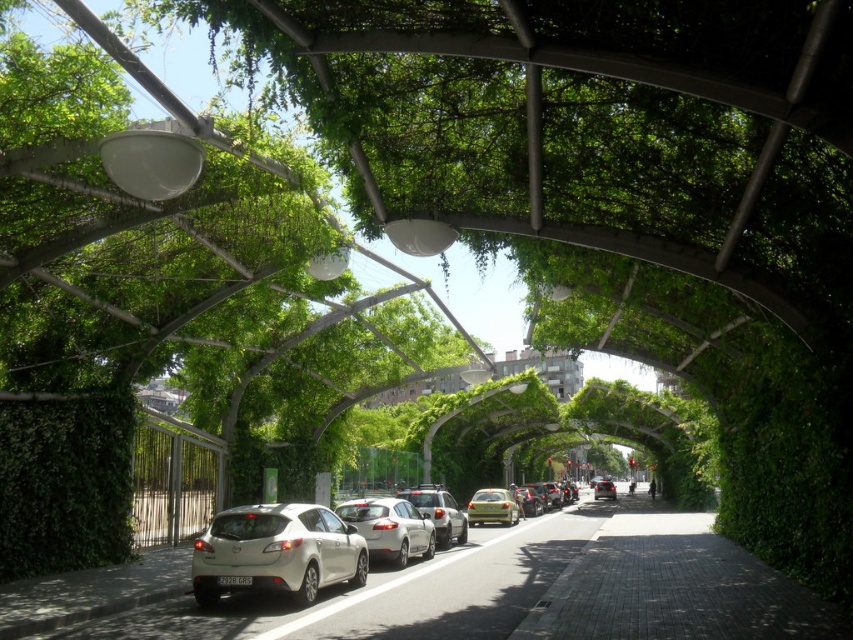
Between green leafy hedge at left and satin white hatchback at center, which one is positioned higher?

green leafy hedge at left is higher up.

What do you see at coordinates (64, 483) in the screenshot?
I see `green leafy hedge at left` at bounding box center [64, 483].

The image size is (853, 640). What are the coordinates of `green leafy hedge at left` in the screenshot? It's located at (64, 483).

What do you see at coordinates (439, 513) in the screenshot? I see `white matte car at center` at bounding box center [439, 513].

Is point (438, 486) in front of point (508, 512)?

No.

The image size is (853, 640). In order to click on white matte car at center in this screenshot , I will do `click(439, 513)`.

Who is more distant from viewer, (323, 552) or (425, 525)?

The point (425, 525) is behind.

Which of these two, white matte hatchback at center or satin white sedan at center, stands shorter?

With less height is satin white sedan at center.

Measure the distance between point [354,541] and camera.

Point [354,541] is 12.67 meters from camera.

The image size is (853, 640). Identify the location of white matte hatchback at center. (276, 552).